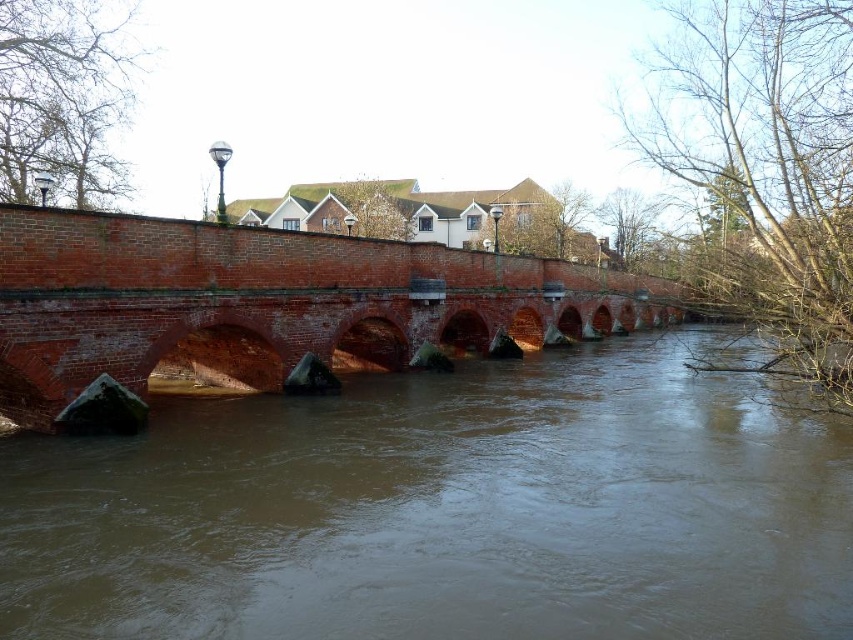
You are an architect analyzing the riverside scene. You need to determine which structure or feature takes up more visual space in the image between the brown clay river at center and the brick bridge at center. Based on the scene description, which one is larger in area?

The brown clay river at center occupies less space than brick bridge at center, so the brick bridge at center is larger in area.

From the picture: You are standing on a path near the riverside and want to cross to the other side. The brick bridge at center is your only option. However, you notice the brown clay river at center. Is the bridge in a position where you can use it to cross the river?

The brown clay river at center is in front of the brick bridge at center, so the bridge is positioned behind the river. This means the bridge is not directly over the river, making it impossible to use for crossing. You would need to find another way to cross the river.